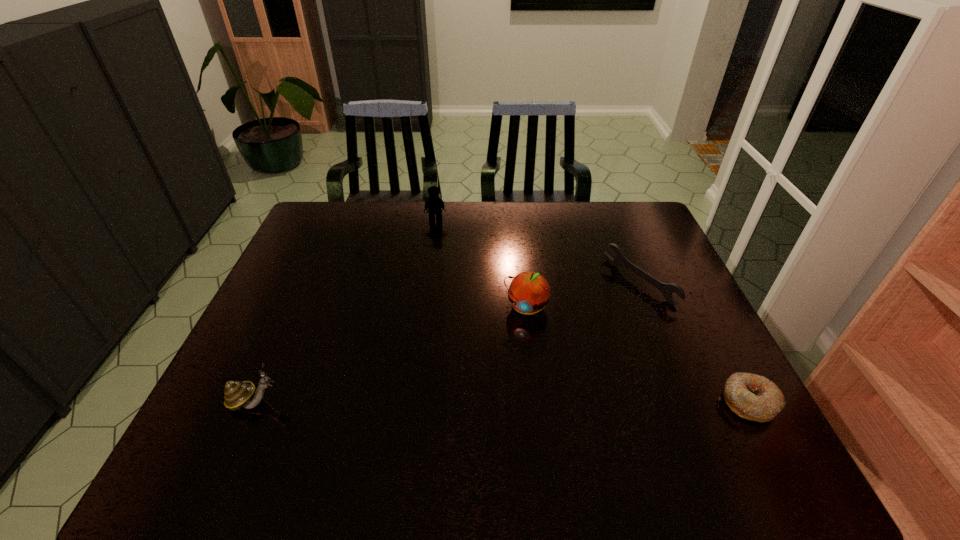
At what (x,y) coordinates should I click in order to perform the action: click on vacant space situated 0.320m on the surface of the third object from left to right. Please return your answer as a coordinate pair (x, y). Looking at the image, I should click on (480, 424).

The image size is (960, 540). What are the coordinates of `blank space located on the front-facing side of the second object from left to right` in the screenshot? It's located at (438, 258).

At what (x,y) coordinates should I click in order to perform the action: click on vacant region located 0.340m on the front-facing side of the second object from left to right. Please return your answer as a coordinate pair (x, y). Looking at the image, I should click on (438, 290).

This screenshot has height=540, width=960. Find the location of `free space located on the front-facing side of the second object from left to right`. free space located on the front-facing side of the second object from left to right is located at coordinates (438, 271).

What are the coordinates of `free region located on the open ends of the fourth tallest object` in the screenshot? It's located at (607, 307).

What are the coordinates of `vacant space located on the open ends of the fourth tallest object` in the screenshot? It's located at (559, 335).

I want to click on vacant space located on the open ends of the fourth tallest object, so [535, 348].

You are a GUI agent. You are given a task and a screenshot of the screen. Output one action in this format:
    pyautogui.click(x=<x>, y=<y>)
    Task: Click on the object that is at the far edge
    The height and width of the screenshot is (540, 960).
    Given the screenshot: What is the action you would take?
    pyautogui.click(x=434, y=204)

The height and width of the screenshot is (540, 960). What are the coordinates of `snail that is positioned at the near edge` in the screenshot? It's located at (237, 394).

Find the location of a particular element. The image size is (960, 540). doughnut present at the near edge is located at coordinates (753, 397).